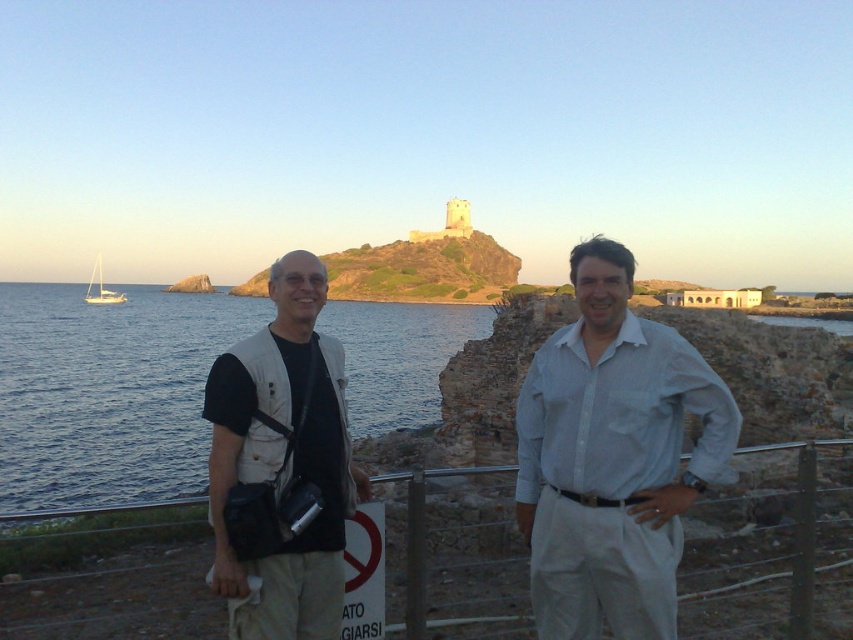
You are a photographer trying to capture a sunset scene. You notice the light beige vest at center in the image. Based on its position, can you estimate where exactly it is located in the frame?

The light beige vest at center is located at point coordinates of 0.688 along the x axis and 0.727 along the y axis.

In the scene shown: You are a photographer trying to capture a sunset scene. You have a camera with a zoom lens. The white cotton shirt at center is located at coordinates point 0.716, 0.719. To ensure the shirt is in the frame, what coordinates should you focus on?

To ensure the white cotton shirt at center is in the frame, focus on the coordinates point (612, 458).

You are a photographer trying to capture a photo of the beige fabric vest at left and the white glossy sailboat at left. Which object should you focus on first if you want to ensure both are in sharp focus?

The beige fabric vest at left has a lesser height compared to the white glossy sailboat at left, so you should focus on the taller white glossy sailboat at left first to ensure both are in sharp focus.